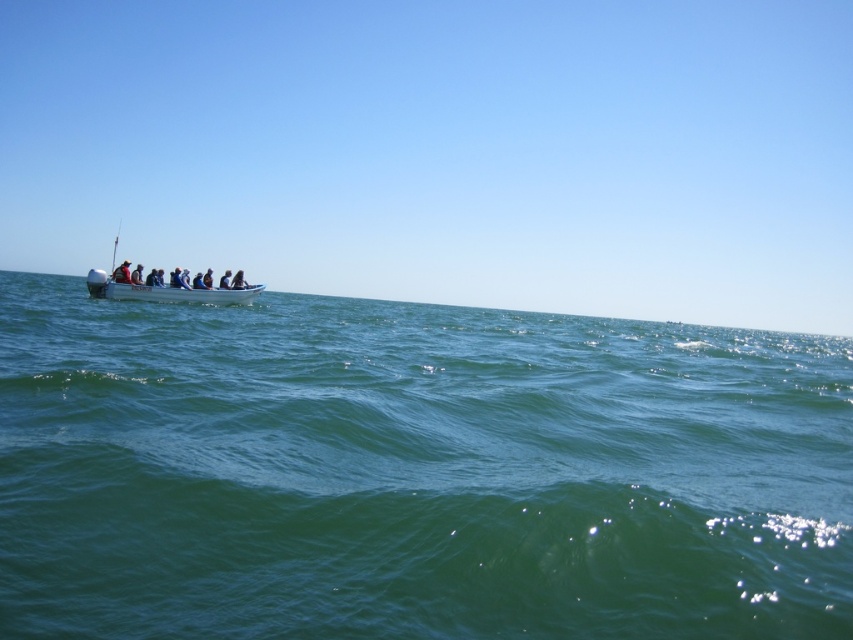
Question: Does green water at left appear over white plastic boat at left?

Choices:
 (A) yes
 (B) no

Answer: (B)

Question: Is green water at left to the right of dark blue fabric boat at center from the viewer's perspective?

Choices:
 (A) no
 (B) yes

Answer: (B)

Question: Is the position of white plastic boat at left more distant than that of dark blue fabric boat at center?

Choices:
 (A) yes
 (B) no

Answer: (B)

Question: Estimate the real-world distances between objects in this image. Which object is closer to the white plastic boat at left?

Choices:
 (A) green water at left
 (B) dark blue fabric boat at center

Answer: (B)

Question: Estimate the real-world distances between objects in this image. Which object is closer to the green water at left?

Choices:
 (A) white plastic boat at left
 (B) dark blue fabric boat at center

Answer: (A)

Question: Which is nearer to the green water at left?

Choices:
 (A) dark blue fabric boat at center
 (B) white plastic boat at left

Answer: (B)